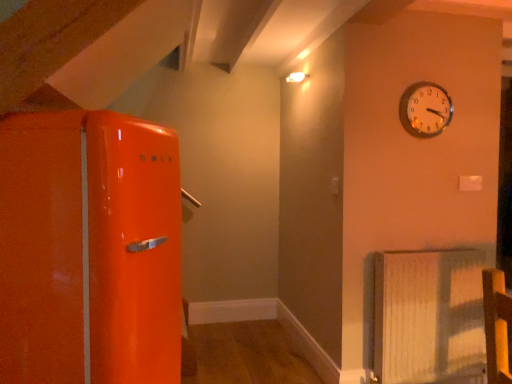
Question: Is the depth of white textured radiator at lower right less than that of metallic gold clock at upper right?

Choices:
 (A) yes
 (B) no

Answer: (A)

Question: Does white textured radiator at lower right have a larger size compared to metallic gold clock at upper right?

Choices:
 (A) no
 (B) yes

Answer: (B)

Question: Can you confirm if white textured radiator at lower right is taller than metallic gold clock at upper right?

Choices:
 (A) no
 (B) yes

Answer: (B)

Question: From a real-world perspective, is white textured radiator at lower right located beneath metallic gold clock at upper right?

Choices:
 (A) no
 (B) yes

Answer: (B)

Question: Is white textured radiator at lower right completely or partially outside of metallic gold clock at upper right?

Choices:
 (A) no
 (B) yes

Answer: (B)

Question: Is white textured radiator at lower right positioned with its back to metallic gold clock at upper right?

Choices:
 (A) no
 (B) yes

Answer: (A)

Question: Is metallic gold clock at upper right positioned far away from white textured radiator at lower right?

Choices:
 (A) yes
 (B) no

Answer: (B)

Question: Considering the relative sizes of metallic gold clock at upper right and white textured radiator at lower right in the image provided, is metallic gold clock at upper right thinner than white textured radiator at lower right?

Choices:
 (A) yes
 (B) no

Answer: (A)

Question: Is metallic gold clock at upper right smaller than white textured radiator at lower right?

Choices:
 (A) yes
 (B) no

Answer: (A)

Question: Does metallic gold clock at upper right touch white textured radiator at lower right?

Choices:
 (A) no
 (B) yes

Answer: (A)

Question: Is white textured radiator at lower right inside metallic gold clock at upper right?

Choices:
 (A) yes
 (B) no

Answer: (B)

Question: Does metallic gold clock at upper right turn towards white textured radiator at lower right?

Choices:
 (A) no
 (B) yes

Answer: (A)

Question: Relative to white textured radiator at lower right, is metallic gold clock at upper right in front or behind?

Choices:
 (A) front
 (B) behind

Answer: (B)